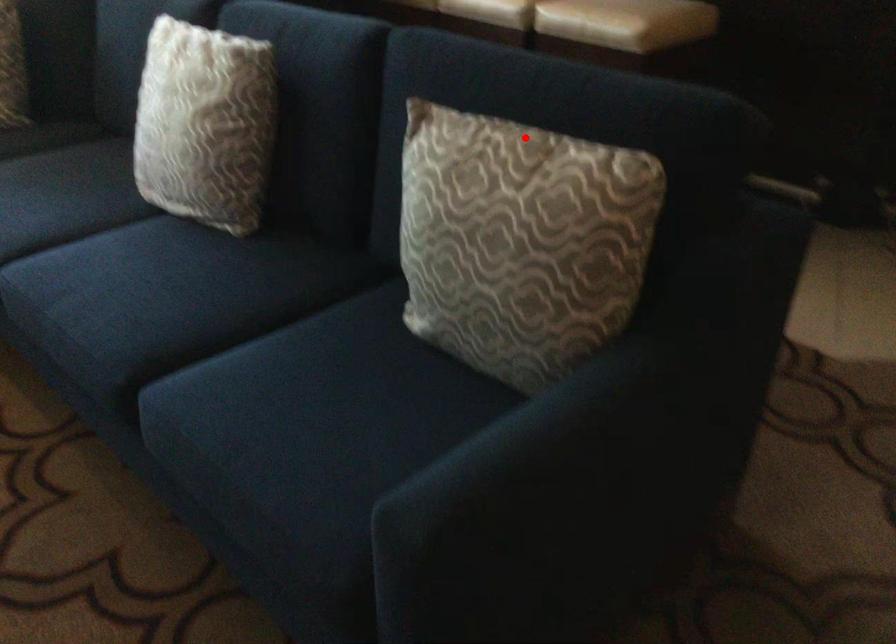
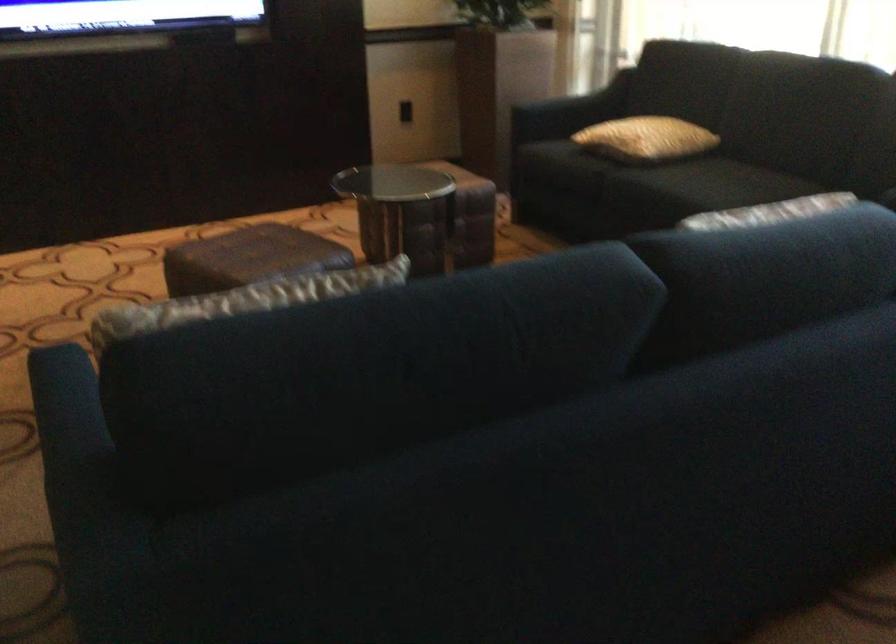
Where in the second image is the point corresponding to the highlighted location from the first image?

(252, 298)